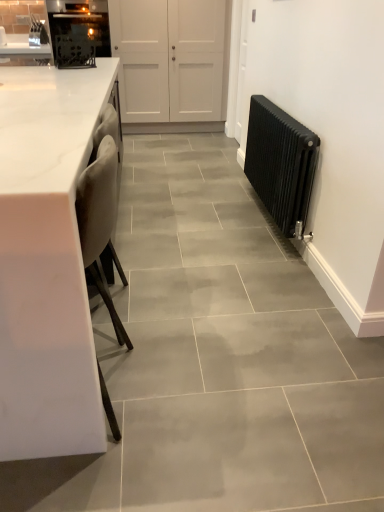
Locate an element on the screen. The height and width of the screenshot is (512, 384). black matte oven at upper left is located at coordinates pos(79,23).

In order to face white matte door at upper center, should I rotate leftwards or rightwards?

A 6.693 degree turn to the left will do.

What do you see at coordinates (281, 164) in the screenshot?
I see `black metal radiator at right` at bounding box center [281, 164].

You are a GUI agent. You are given a task and a screenshot of the screen. Output one action in this format:
    pyautogui.click(x=<x>, y=<y>)
    Task: Click on the black matte oven at upper left
    Image resolution: width=384 pixels, height=512 pixels.
    Given the screenshot: What is the action you would take?
    pyautogui.click(x=79, y=23)

Between black metal radiator at right and white marble countertop at left, which one has less height?

black metal radiator at right is shorter.

Does point (313, 167) come closer to viewer compared to point (45, 166)?

No, it is not.

You are a GUI agent. You are given a task and a screenshot of the screen. Output one action in this format:
    pyautogui.click(x=<x>, y=<y>)
    Task: Click on the radiator lying behind the white marble countertop at left
    The height and width of the screenshot is (512, 384).
    Given the screenshot: What is the action you would take?
    pyautogui.click(x=281, y=164)

Would you say black metal radiator at right is to the left or to the right of white marble countertop at left in the picture?

Clearly, black metal radiator at right is on the right of white marble countertop at left in the image.

From the image's perspective, which one is positioned lower, white matte door at upper center or black metal radiator at right?

black metal radiator at right.

Which point is more distant from viewer, (187, 64) or (295, 200)?

The point (187, 64) is farther from the camera.

Are white matte door at upper center and black metal radiator at right far apart?

Yes, white matte door at upper center and black metal radiator at right are quite far apart.

Does white matte door at upper center have a greater height compared to black metal radiator at right?

Correct, white matte door at upper center is much taller as black metal radiator at right.

Is black matte oven at upper left in front of or behind black metal radiator at right in the image?

black matte oven at upper left is positioned farther from the viewer than black metal radiator at right.

Does black matte oven at upper left have a smaller size compared to black metal radiator at right?

No, black matte oven at upper left is not smaller than black metal radiator at right.

Consider the image. Could you tell me if black matte oven at upper left is facing black metal radiator at right?

No, black matte oven at upper left is not turned towards black metal radiator at right.

From the image's perspective, does white marble countertop at left appear lower than white matte door at upper center?

Correct, white marble countertop at left appears lower than white matte door at upper center in the image.

From a real-world perspective, is white marble countertop at left physically located above or below white matte door at upper center?

From a real-world perspective, white marble countertop at left is physically below white matte door at upper center.

Is white marble countertop at left positioned with its back to white matte door at upper center?

Yes, white marble countertop at left is facing away from white matte door at upper center.

Identify the location of countertop on the left of the white matte door at upper center. Image resolution: width=384 pixels, height=512 pixels. (47, 263).

Looking at their sizes, would you say black matte oven at upper left is wider or thinner than white marble countertop at left?

black matte oven at upper left is thinner than white marble countertop at left.

Which object is further away from the camera taking this photo, black matte oven at upper left or white marble countertop at left?

black matte oven at upper left is further from the camera.

Can you tell me how much black matte oven at upper left and white marble countertop at left differ in facing direction?

1.75 degrees separate the facing orientations of black matte oven at upper left and white marble countertop at left.

Visually, is black metal radiator at right positioned to the left or to the right of black matte oven at upper left?

From the image, it's evident that black metal radiator at right is to the right of black matte oven at upper left.

Considering the positions of points (268, 156) and (94, 25), is point (268, 156) closer to camera compared to point (94, 25)?

Yes, point (268, 156) is closer to viewer.

Between black metal radiator at right and black matte oven at upper left, which one has more height?

With more height is black matte oven at upper left.

The width and height of the screenshot is (384, 512). In order to click on radiator on the right side of black matte oven at upper left in this screenshot , I will do `click(281, 164)`.

Who is taller, white matte door at upper center or white marble countertop at left?

Standing taller between the two is white matte door at upper center.

From the image's perspective, is white matte door at upper center above or below white marble countertop at left?

white matte door at upper center is above white marble countertop at left.

Can you confirm if white matte door at upper center is positioned to the right of white marble countertop at left?

Indeed, white matte door at upper center is positioned on the right side of white marble countertop at left.

Considering the relative positions of white matte door at upper center and white marble countertop at left in the image provided, is white matte door at upper center behind white marble countertop at left?

That is True.

You are a GUI agent. You are given a task and a screenshot of the screen. Output one action in this format:
    pyautogui.click(x=<x>, y=<y>)
    Task: Click on the radiator below the white marble countertop at left (from a real-world perspective)
    
    Given the screenshot: What is the action you would take?
    pyautogui.click(x=281, y=164)

This screenshot has height=512, width=384. What are the coordinates of `door on the left of black metal radiator at right` in the screenshot? It's located at (169, 59).

Looking at the image, which one is located closer to black metal radiator at right, white matte door at upper center or black matte oven at upper left?

Based on the image, white matte door at upper center appears to be nearer to black metal radiator at right.

When comparing their distances from black metal radiator at right, does black matte oven at upper left or white marble countertop at left seem further?

black matte oven at upper left is further to black metal radiator at right.

Looking at this image, looking at the image, which one is located closer to white marble countertop at left, black metal radiator at right or white matte door at upper center?

black metal radiator at right is positioned closer to the anchor white marble countertop at left.

Looking at the image, which one is located closer to black matte oven at upper left, black metal radiator at right or white matte door at upper center?

The object closer to black matte oven at upper left is white matte door at upper center.

When comparing their distances from white matte door at upper center, does white marble countertop at left or black metal radiator at right seem further?

Among the two, white marble countertop at left is located further to white matte door at upper center.

From the picture: Which object lies nearer to the anchor point white marble countertop at left, white matte door at upper center or black metal radiator at right?

black metal radiator at right is closer to white marble countertop at left.

Consider the image. Looking at the image, which one is located closer to black metal radiator at right, white marble countertop at left or white matte door at upper center?

white marble countertop at left.

From the image, which object appears to be nearer to white marble countertop at left, black matte oven at upper left or black metal radiator at right?

Based on the image, black metal radiator at right appears to be nearer to white marble countertop at left.

Locate an element on the screen. The width and height of the screenshot is (384, 512). door between black metal radiator at right and black matte oven at upper left from front to back is located at coordinates (169, 59).

Image resolution: width=384 pixels, height=512 pixels. What are the coordinates of `door between white marble countertop at left and black matte oven at upper left along the z-axis` in the screenshot? It's located at (169, 59).

This screenshot has height=512, width=384. Find the location of `radiator between white marble countertop at left and white matte door at upper center in the front-back direction`. radiator between white marble countertop at left and white matte door at upper center in the front-back direction is located at coordinates (281, 164).

The width and height of the screenshot is (384, 512). What are the coordinates of `radiator between white marble countertop at left and black matte oven at upper left along the z-axis` in the screenshot? It's located at (281, 164).